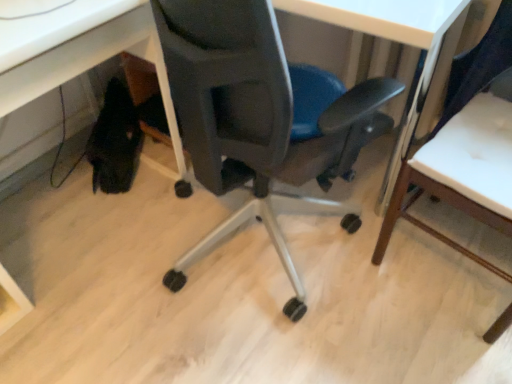
Measure the distance between point (375, 261) and camera.

A distance of 4.58 feet exists between point (375, 261) and camera.

This screenshot has height=384, width=512. In order to click on matte black chair at lower left in this screenshot , I will do `click(79, 52)`.

Find the location of a particular element. wooden chair at right, the 2th chair in the left-to-right sequence is located at coordinates (482, 67).

Could you measure the distance between matte black chair at center, which is counted as the 2th chair, starting from the right, and matte black chair at lower left?

They are 16.05 inches apart.

Which object is closer to the camera, matte black chair at center, which is counted as the 2th chair, starting from the right, or matte black chair at lower left?

Positioned in front is matte black chair at lower left.

Is matte black chair at center, which is the first chair from left to right, placed right next to matte black chair at lower left?

No, matte black chair at center, which is the first chair from left to right, is not next to matte black chair at lower left.

Is matte black chair at center, which is counted as the 2th chair, starting from the right, aimed at matte black chair at lower left?

Yes, matte black chair at center, which is counted as the 2th chair, starting from the right, is oriented towards matte black chair at lower left.

How different are the orientations of matte black chair at lower left and wooden chair at right, the first chair viewed from the right, in degrees?

96.4 degrees.

Between matte black chair at lower left and wooden chair at right, the first chair viewed from the right, which one has smaller width?

With smaller width is wooden chair at right, the first chair viewed from the right.

Can you confirm if matte black chair at lower left is positioned to the left of wooden chair at right, the 2th chair in the left-to-right sequence?

Yes.

The width and height of the screenshot is (512, 384). What are the coordinates of `computer desk that appears on the left of wooden chair at right, the 2th chair in the left-to-right sequence` in the screenshot? It's located at 79,52.

Does matte black chair at center, which is the first chair from left to right, have a greater width compared to wooden chair at right, the 2th chair in the left-to-right sequence?

Correct, the width of matte black chair at center, which is the first chair from left to right, exceeds that of wooden chair at right, the 2th chair in the left-to-right sequence.

Based on the photo, is matte black chair at center, which is the first chair from left to right, beside wooden chair at right, the first chair viewed from the right?

No.

How much distance is there between matte black chair at center, which is the first chair from left to right, and wooden chair at right, the first chair viewed from the right?

matte black chair at center, which is the first chair from left to right, is 14.57 inches away from wooden chair at right, the first chair viewed from the right.

Which of these two, matte black chair at center, which is counted as the 2th chair, starting from the right, or wooden chair at right, the first chair viewed from the right, stands shorter?

With less height is wooden chair at right, the first chair viewed from the right.

Is matte black chair at lower left behind matte black chair at center, which is counted as the 2th chair, starting from the right?

No, matte black chair at lower left is closer to the camera.

Based on the photo, who is bigger, matte black chair at lower left or matte black chair at center, which is the first chair from left to right?

matte black chair at center, which is the first chair from left to right.

Which object is positioned more to the right, matte black chair at lower left or matte black chair at center, which is counted as the 2th chair, starting from the right?

matte black chair at center, which is counted as the 2th chair, starting from the right.

Is matte black chair at lower left not within matte black chair at center, which is counted as the 2th chair, starting from the right?

Yes.

Is the depth of wooden chair at right, the first chair viewed from the right, less than that of matte black chair at lower left?

Yes, wooden chair at right, the first chair viewed from the right, is closer to the camera.

Could you tell me if wooden chair at right, the first chair viewed from the right, is turned towards matte black chair at lower left?

No.

Is wooden chair at right, the 2th chair in the left-to-right sequence, inside or outside of matte black chair at lower left?

wooden chair at right, the 2th chair in the left-to-right sequence, is outside matte black chair at lower left.

Is wooden chair at right, the 2th chair in the left-to-right sequence, positioned with its back to matte black chair at center, which is counted as the 2th chair, starting from the right?

No, wooden chair at right, the 2th chair in the left-to-right sequence, is not facing away from matte black chair at center, which is counted as the 2th chair, starting from the right.

Is wooden chair at right, the first chair viewed from the right, spatially inside matte black chair at center, which is the first chair from left to right, or outside of it?

wooden chair at right, the first chair viewed from the right, cannot be found inside matte black chair at center, which is the first chair from left to right.

From the picture: Considering the relative sizes of wooden chair at right, the 2th chair in the left-to-right sequence, and matte black chair at center, which is counted as the 2th chair, starting from the right, in the image provided, is wooden chair at right, the 2th chair in the left-to-right sequence, shorter than matte black chair at center, which is counted as the 2th chair, starting from the right,?

Yes, wooden chair at right, the 2th chair in the left-to-right sequence, is shorter than matte black chair at center, which is counted as the 2th chair, starting from the right.

Who is smaller, wooden chair at right, the first chair viewed from the right, or matte black chair at center, which is counted as the 2th chair, starting from the right?

wooden chair at right, the first chair viewed from the right.

Find the location of a particular element. The image size is (512, 384). computer desk that is on the left side of matte black chair at center, which is the first chair from left to right is located at coordinates (79, 52).

Find the location of a particular element. This screenshot has height=384, width=512. chair below the matte black chair at lower left (from the image's perspective) is located at coordinates (482, 67).

Based on their spatial positions, is matte black chair at lower left or matte black chair at center, which is counted as the 2th chair, starting from the right, further from wooden chair at right, the first chair viewed from the right?

matte black chair at lower left is positioned further to the anchor wooden chair at right, the first chair viewed from the right.

Which object lies nearer to the anchor point wooden chair at right, the first chair viewed from the right, matte black chair at center, which is counted as the 2th chair, starting from the right, or matte black chair at lower left?

Based on the image, matte black chair at center, which is counted as the 2th chair, starting from the right, appears to be nearer to wooden chair at right, the first chair viewed from the right.

When comparing their distances from matte black chair at center, which is counted as the 2th chair, starting from the right, does matte black chair at lower left or wooden chair at right, the first chair viewed from the right, seem closer?

wooden chair at right, the first chair viewed from the right.

Based on their spatial positions, is wooden chair at right, the first chair viewed from the right, or matte black chair at lower left further from matte black chair at center, which is the first chair from left to right?

matte black chair at lower left.

Based on the photo, considering their positions, is matte black chair at center, which is the first chair from left to right, positioned further to matte black chair at lower left than wooden chair at right, the 2th chair in the left-to-right sequence?

Based on the image, wooden chair at right, the 2th chair in the left-to-right sequence, appears to be further to matte black chair at lower left.

Looking at the image, which one is located further to matte black chair at lower left, wooden chair at right, the 2th chair in the left-to-right sequence, or matte black chair at center, which is counted as the 2th chair, starting from the right?

Based on the image, wooden chair at right, the 2th chair in the left-to-right sequence, appears to be further to matte black chair at lower left.

Find the location of `chair between matte black chair at lower left and wooden chair at right, the 2th chair in the left-to-right sequence`. chair between matte black chair at lower left and wooden chair at right, the 2th chair in the left-to-right sequence is located at coordinates (261, 118).